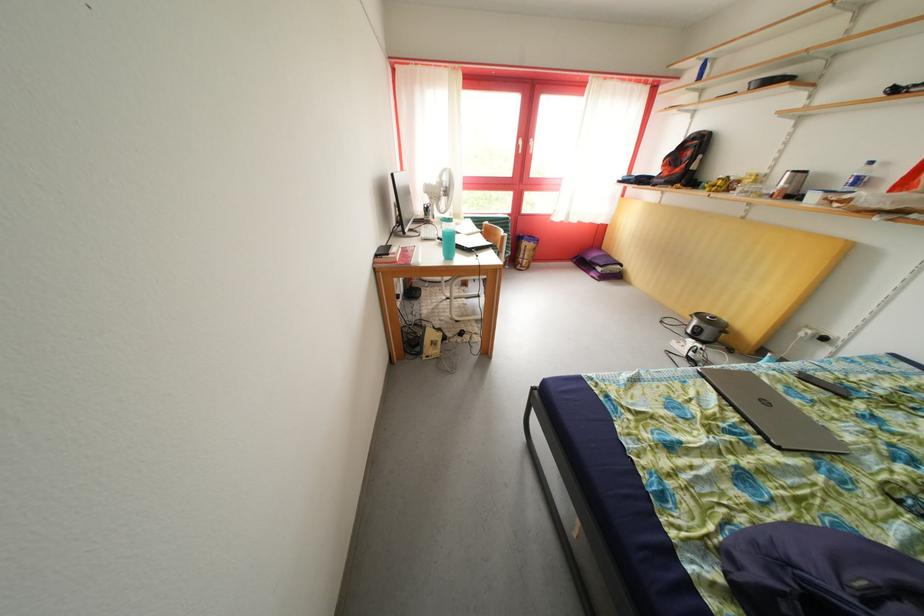
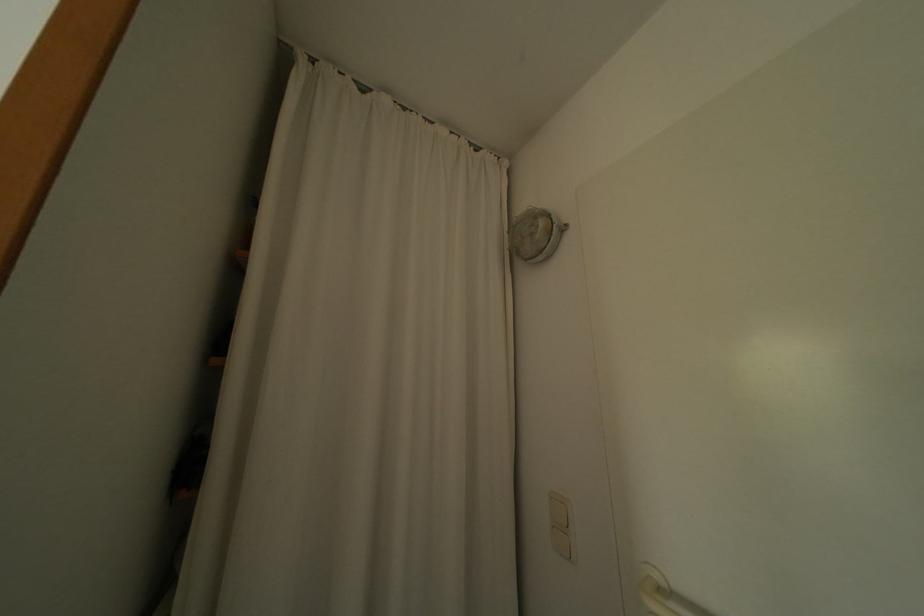
Question: The camera is either moving clockwise (left) or counter-clockwise (right) around the object. The first image is from the beginning of the video and the second image is from the end. Is the camera moving left or right when shooting the video?

Choices:
 (A) Left
 (B) Right

Answer: (A)